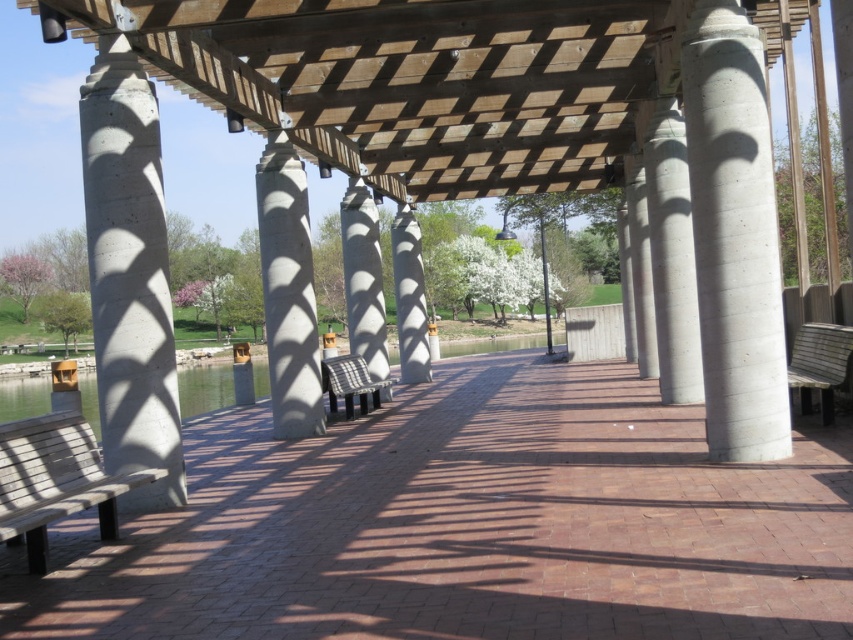
Is clear water at center shorter than wooden bench at center?

No, clear water at center is not shorter than wooden bench at center.

In the scene shown: Does clear water at center have a smaller size compared to wooden bench at center?

No.

Where is `clear water at center`? This screenshot has height=640, width=853. clear water at center is located at coordinates (204, 388).

Who is more forward, (131, 429) or (689, 273)?

Point (131, 429) is more forward.

Is gray concrete column at left bigger than concrete/smooth pillar at center-right?

Correct, gray concrete column at left is larger in size than concrete/smooth pillar at center-right.

You are a GUI agent. You are given a task and a screenshot of the screen. Output one action in this format:
    pyautogui.click(x=<x>, y=<y>)
    Task: Click on the gray concrete column at left
    
    Given the screenshot: What is the action you would take?
    pyautogui.click(x=129, y=275)

Is brown brick path at center shorter than concrete/rough textured bench at center?

Yes, brown brick path at center is shorter than concrete/rough textured bench at center.

Can you confirm if brown brick path at center is positioned to the left of concrete/rough textured bench at center?

No, brown brick path at center is not to the left of concrete/rough textured bench at center.

Does point (851, 612) come behind point (357, 225)?

No, it is not.

Where is `brown brick path at center`? brown brick path at center is located at coordinates (468, 525).